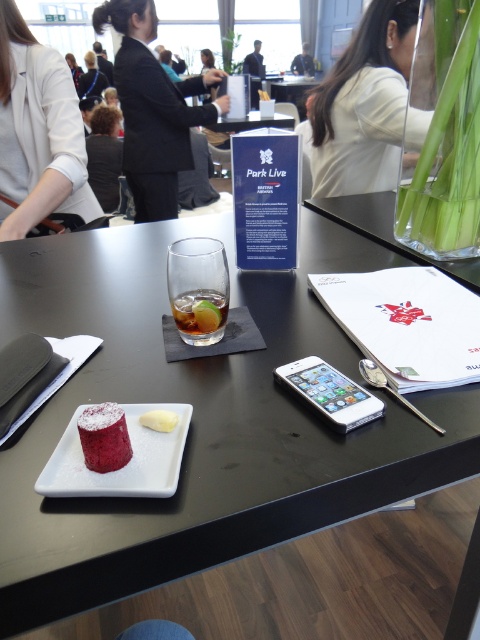
Can you confirm if smooth black table at center is shorter than smooth pink cake at center?

No, smooth black table at center is not shorter than smooth pink cake at center.

Who is more distant from viewer, (339, 344) or (97, 440)?

The point (339, 344) is behind.

Does point (34, 269) come closer to viewer compared to point (120, 426)?

No, (34, 269) is behind (120, 426).

This screenshot has height=640, width=480. I want to click on smooth black table at center, so click(199, 420).

Measure the distance between translucent glass at center and white creamy cheese at center.

translucent glass at center and white creamy cheese at center are 8.23 inches apart.

What do you see at coordinates (197, 289) in the screenshot? I see `translucent glass at center` at bounding box center [197, 289].

Locate an element on the screen. translucent glass at center is located at coordinates coord(197,289).

Based on the photo, which is more to the right, clear glass at center or dark suit jacket at center?

clear glass at center is more to the right.

Does clear glass at center have a larger size compared to dark suit jacket at center?

No, clear glass at center is not bigger than dark suit jacket at center.

This screenshot has height=640, width=480. Describe the element at coordinates (200, 316) in the screenshot. I see `clear glass at center` at that location.

You are a GUI agent. You are given a task and a screenshot of the screen. Output one action in this format:
    pyautogui.click(x=<x>, y=<y>)
    Task: Click on the clear glass at center
    
    Given the screenshot: What is the action you would take?
    pyautogui.click(x=200, y=316)